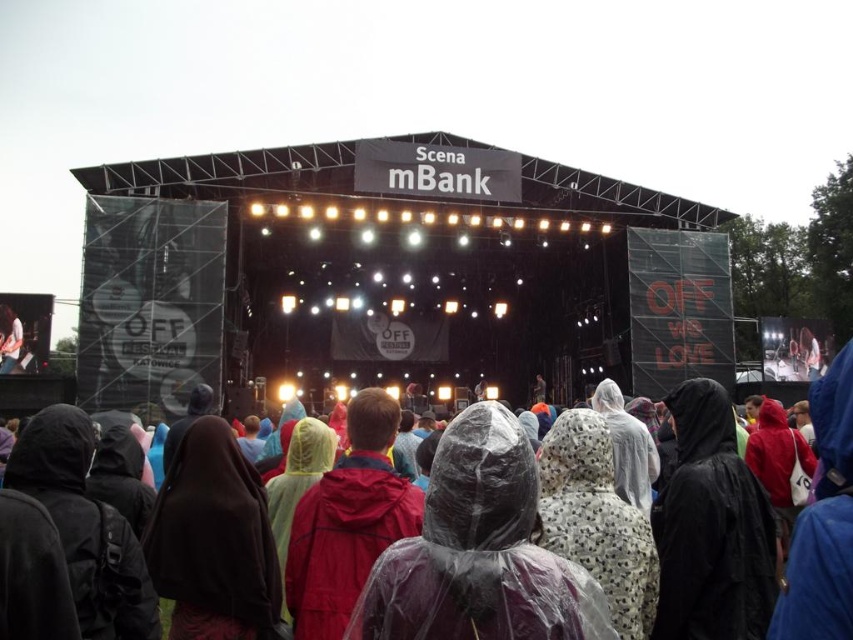
Question: Can you confirm if transparent plastic poncho at center is positioned above white glossy shoe at center?

Choices:
 (A) yes
 (B) no

Answer: (B)

Question: Which point is farther to the camera?

Choices:
 (A) transparent plastic poncho at center
 (B) white glossy shoe at center

Answer: (B)

Question: Where is transparent plastic poncho at center located in relation to white glossy shoe at center in the image?

Choices:
 (A) left
 (B) right

Answer: (B)

Question: Which point is closer to the camera?

Choices:
 (A) transparent plastic poncho at center
 (B) white glossy shoe at center

Answer: (A)

Question: Does transparent plastic poncho at center come behind white glossy shoe at center?

Choices:
 (A) yes
 (B) no

Answer: (B)